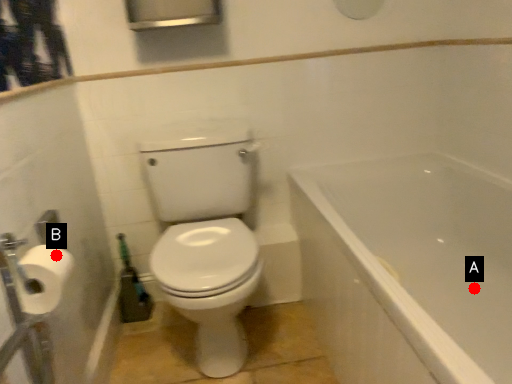
Question: Two points are circled on the image, labeled by A and B beside each circle. Which point is closer to the camera?

Choices:
 (A) A is closer
 (B) B is closer

Answer: (B)